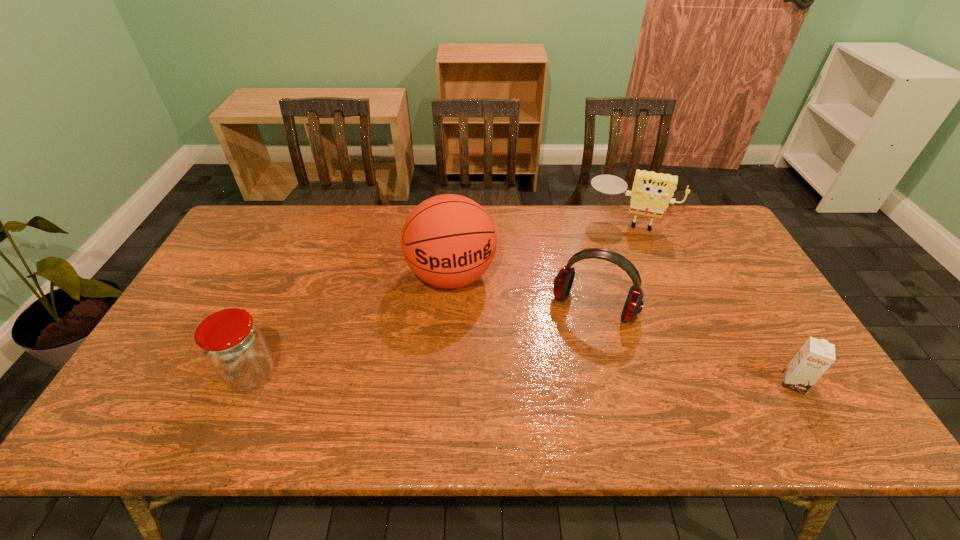
Where is `jar`? jar is located at coordinates (233, 345).

Locate an element on the screen. the rightmost object is located at coordinates (816, 356).

Locate an element on the screen. chocolate milk is located at coordinates (816, 356).

At what (x,y) coordinates should I click in order to perform the action: click on the farthest object. Please return your answer as a coordinate pair (x, y). This screenshot has width=960, height=540. Looking at the image, I should click on (651, 192).

This screenshot has height=540, width=960. I want to click on the tallest object, so click(x=449, y=241).

Find the location of `basketball`. basketball is located at coordinates (449, 241).

Where is `earphone`? earphone is located at coordinates (563, 281).

You are a GUI agent. You are given a task and a screenshot of the screen. Output one action in this format:
    pyautogui.click(x=<x>, y=<y>)
    Task: Click on the free spot located on the left of the jar
    
    Given the screenshot: What is the action you would take?
    pyautogui.click(x=205, y=374)

Image resolution: width=960 pixels, height=540 pixels. I want to click on vacant area located on the back of the chocolate milk, so click(x=754, y=316).

Where is `vacant space located 0.180m on the front-facing side of the sponge`? Image resolution: width=960 pixels, height=540 pixels. vacant space located 0.180m on the front-facing side of the sponge is located at coordinates (612, 266).